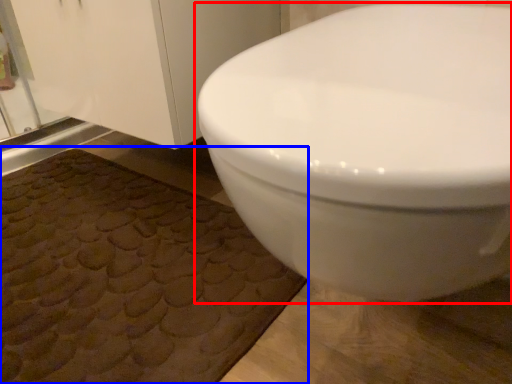
Question: Among these objects, which one is nearest to the camera, toilet (highlighted by a red box) or bath mat (highlighted by a blue box)?

Choices:
 (A) toilet
 (B) bath mat

Answer: (A)